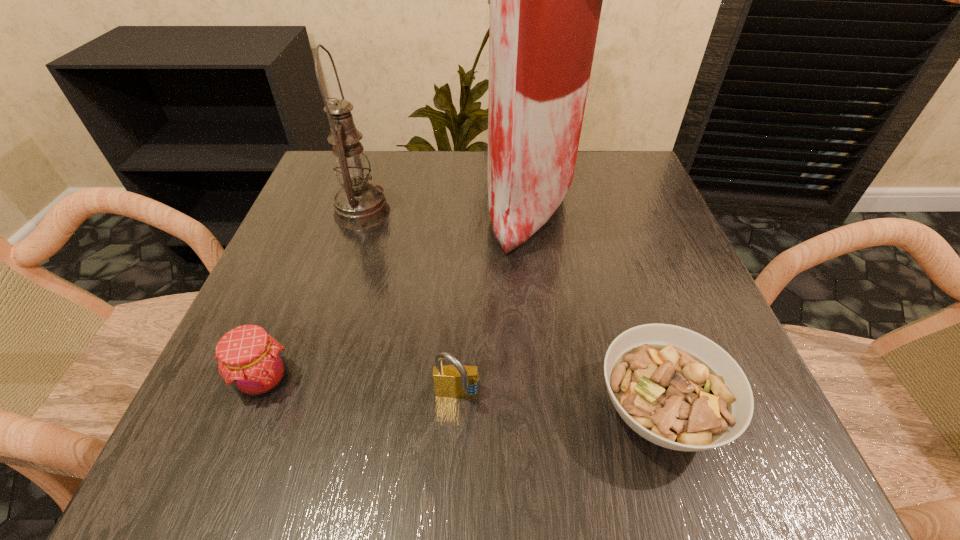
At what (x,y) coordinates should I click in order to perform the action: click on grocery bag at the far edge. Please return your answer as a coordinate pair (x, y). This screenshot has width=960, height=540. Looking at the image, I should click on (545, 0).

Locate an element on the screen. The height and width of the screenshot is (540, 960). oil lamp that is at the far edge is located at coordinates (359, 205).

What are the coordinates of `object that is at the near edge` in the screenshot? It's located at (676, 388).

Where is `oil lamp located in the left edge section of the desktop`? oil lamp located in the left edge section of the desktop is located at coordinates (x=359, y=205).

Identify the location of jam at the left edge. (250, 360).

You are a GUI agent. You are given a task and a screenshot of the screen. Output one action in this format:
    pyautogui.click(x=<x>, y=<y>)
    Task: Click on the grocery bag situated at the right edge
    
    Given the screenshot: What is the action you would take?
    pyautogui.click(x=545, y=0)

I want to click on stew positioned at the right edge, so click(x=676, y=388).

Locate an element on the screen. The width and height of the screenshot is (960, 540). object at the far left corner is located at coordinates (359, 205).

This screenshot has width=960, height=540. Find the location of `object that is positioned at the far right corner`. object that is positioned at the far right corner is located at coordinates (545, 0).

In order to click on object located at the near right corner in this screenshot , I will do `click(676, 388)`.